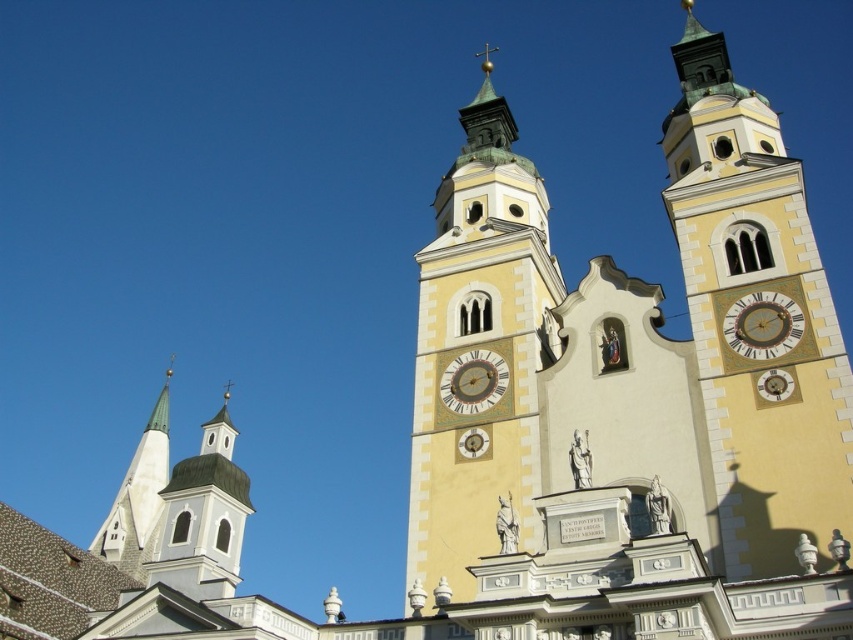
Can you confirm if yellow painted stone clock tower at right is positioned to the right of yellow stone clock tower at center?

Yes, yellow painted stone clock tower at right is to the right of yellow stone clock tower at center.

Who is lower down, yellow painted stone clock tower at right or yellow stone clock tower at center?

yellow painted stone clock tower at right

Is point (764, 576) positioned after point (416, 257)?

No, it is in front of (416, 257).

Identify the location of yellow painted stone clock tower at right. Image resolution: width=853 pixels, height=640 pixels. (756, 317).

What do you see at coordinates (763, 324) in the screenshot?
I see `gold/brass clock at right` at bounding box center [763, 324].

Does gold/brass clock at right appear over gold metallic clock at center?

Yes, gold/brass clock at right is above gold metallic clock at center.

Who is more forward, (795, 326) or (486, 396)?

Point (795, 326) is in front.

Locate an element on the screen. The image size is (853, 640). gold/brass clock at right is located at coordinates (763, 324).

Who is positioned more to the right, yellow painted stone clock tower at right or gold/brass clock at right?

yellow painted stone clock tower at right

What do you see at coordinates (756, 317) in the screenshot? I see `yellow painted stone clock tower at right` at bounding box center [756, 317].

The height and width of the screenshot is (640, 853). I want to click on yellow painted stone clock tower at right, so click(756, 317).